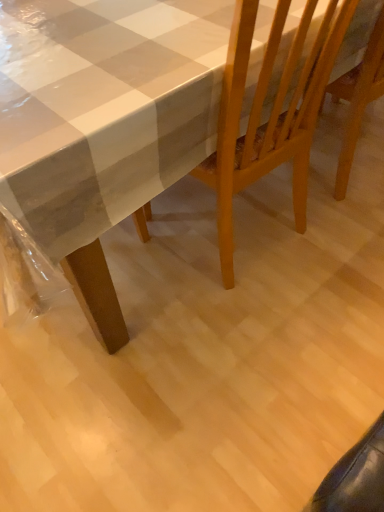
Identify the location of white glossy table at upper left. The image size is (384, 512). (103, 121).

Image resolution: width=384 pixels, height=512 pixels. What do you see at coordinates (103, 121) in the screenshot?
I see `white glossy table at upper left` at bounding box center [103, 121].

What do you see at coordinates (270, 114) in the screenshot? I see `wooden chair at center` at bounding box center [270, 114].

I want to click on wooden chair at center, so click(x=270, y=114).

At what (x,y) coordinates should I click in order to perform the action: click on white glossy table at upper left. Please return your answer as a coordinate pair (x, y). Image resolution: width=384 pixels, height=512 pixels. Looking at the image, I should click on (103, 121).

Considering the relative positions of wooden chair at center and white glossy table at upper left in the image provided, is wooden chair at center to the left or to the right of white glossy table at upper left?

Based on their positions, wooden chair at center is located to the right of white glossy table at upper left.

Who is more distant, wooden chair at center or white glossy table at upper left?

wooden chair at center is behind.

Is point (242, 68) positioned after point (43, 34)?

No, it is not.

From the image's perspective, would you say wooden chair at center is shown under white glossy table at upper left?

Correct, wooden chair at center appears lower than white glossy table at upper left in the image.

From a real-world perspective, is wooden chair at center located beneath white glossy table at upper left?

No, from a real-world perspective, wooden chair at center is not below white glossy table at upper left.

Which object is thinner, wooden chair at center or white glossy table at upper left?

Thinner between the two is wooden chair at center.

Does wooden chair at center have a lesser height compared to white glossy table at upper left?

Incorrect, the height of wooden chair at center does not fall short of that of white glossy table at upper left.

In terms of size, does wooden chair at center appear bigger or smaller than white glossy table at upper left?

wooden chair at center is smaller than white glossy table at upper left.

Is wooden chair at center located outside white glossy table at upper left?

No, wooden chair at center is inside white glossy table at upper left's boundary.

Is wooden chair at center far from white glossy table at upper left?

No, wooden chair at center is in close proximity to white glossy table at upper left.

Is wooden chair at center turned away from white glossy table at upper left?

Absolutely, wooden chair at center is directed away from white glossy table at upper left.

Can you tell me how much wooden chair at center and white glossy table at upper left differ in facing direction?

0.00109 degrees separate the facing orientations of wooden chair at center and white glossy table at upper left.

How far apart are wooden chair at center and white glossy table at upper left?

wooden chair at center and white glossy table at upper left are 9.55 inches apart.

Identify the location of chair behind the white glossy table at upper left. (270, 114).

Considering the relative positions of white glossy table at upper left and wooden chair at center in the image provided, is white glossy table at upper left to the left or to the right of wooden chair at center?

From the image, it's evident that white glossy table at upper left is to the left of wooden chair at center.

Which object is closer to the camera, white glossy table at upper left or wooden chair at center?

white glossy table at upper left is in front.

Which is less distant, (132, 139) or (309, 79)?

The point (132, 139) is more forward.

From the image's perspective, does white glossy table at upper left appear lower than wooden chair at center?

Incorrect, from the image's perspective, white glossy table at upper left is higher than wooden chair at center.

From a real-world perspective, is white glossy table at upper left physically located above or below wooden chair at center?

From a real-world perspective, white glossy table at upper left is physically below wooden chair at center.

Looking at their sizes, would you say white glossy table at upper left is wider or thinner than wooden chair at center?

Considering their sizes, white glossy table at upper left looks broader than wooden chair at center.

Considering the sizes of white glossy table at upper left and wooden chair at center in the image, is white glossy table at upper left taller or shorter than wooden chair at center?

white glossy table at upper left is shorter than wooden chair at center.

Considering the sizes of objects white glossy table at upper left and wooden chair at center in the image provided, who is smaller, white glossy table at upper left or wooden chair at center?

With smaller size is wooden chair at center.

Is white glossy table at upper left completely or partially outside of wooden chair at center?

white glossy table at upper left lies outside wooden chair at center's area.

Does white glossy table at upper left touch wooden chair at center?

No, white glossy table at upper left is not touching wooden chair at center.

Is white glossy table at upper left turned away from wooden chair at center?

Yes, white glossy table at upper left is positioned with its back facing wooden chair at center.

How many degrees apart are the facing directions of white glossy table at upper left and wooden chair at center?

white glossy table at upper left and wooden chair at center are facing 0.00109 degrees away from each other.

How distant is white glossy table at upper left from wooden chair at center?

They are 9.55 inches apart.

Image resolution: width=384 pixels, height=512 pixels. Identify the location of table lying on the left of wooden chair at center. (103, 121).

Identify the location of table on the left side of wooden chair at center. (103, 121).

Where is `chair behind the white glossy table at upper left`? chair behind the white glossy table at upper left is located at coordinates (270, 114).